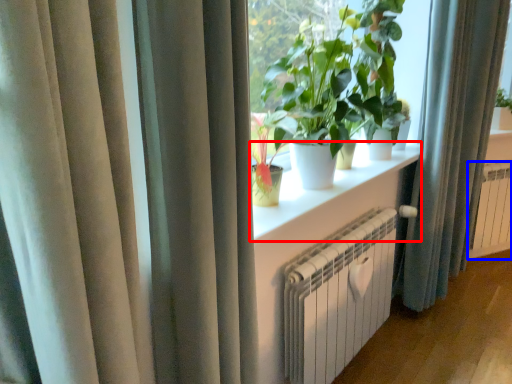
Question: Which object appears farthest to the camera in this image, window sill (highlighted by a red box) or radiator (highlighted by a blue box)?

Choices:
 (A) window sill
 (B) radiator

Answer: (B)